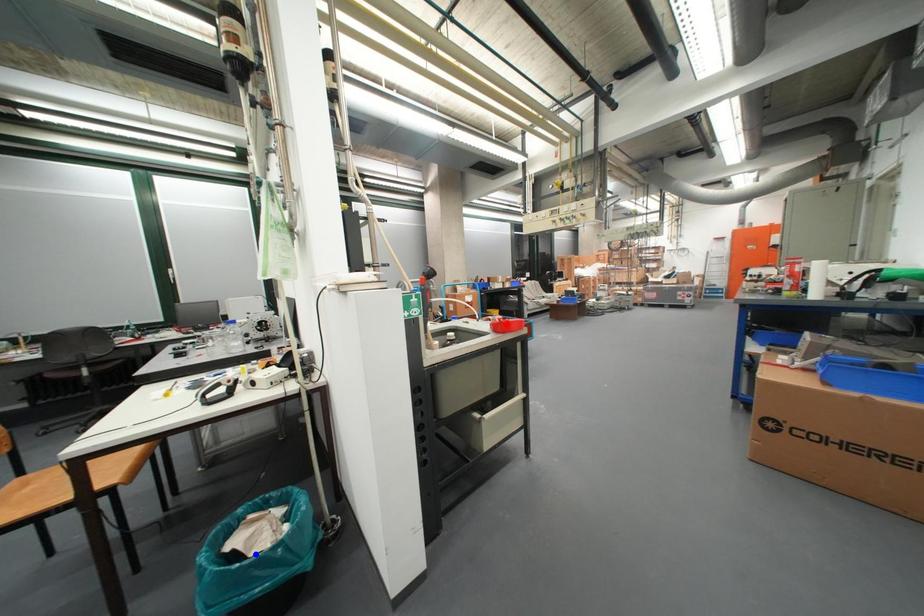
Question: Which of the two points in the image is closer to the camera?

Choices:
 (A) Blue point is closer.
 (B) Red point is closer.

Answer: (A)